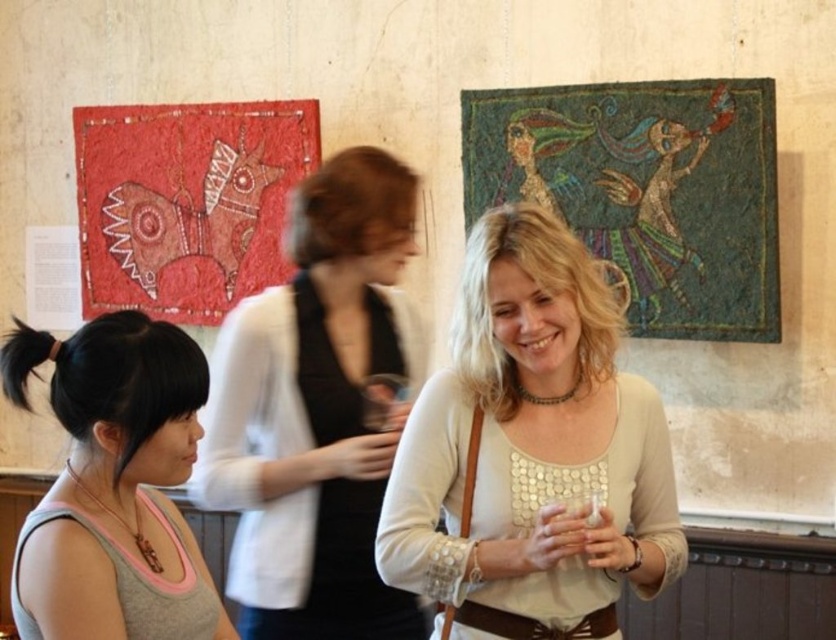
You are an art curator standing in the gallery. You need to place a small decorative item exactly at the point with coordinates point (646, 189). Which artwork should you place it on?

The point (646, 189) is on the textured mosaic at upper right, so you should place the decorative item on the artwork on the right side of the gallery.